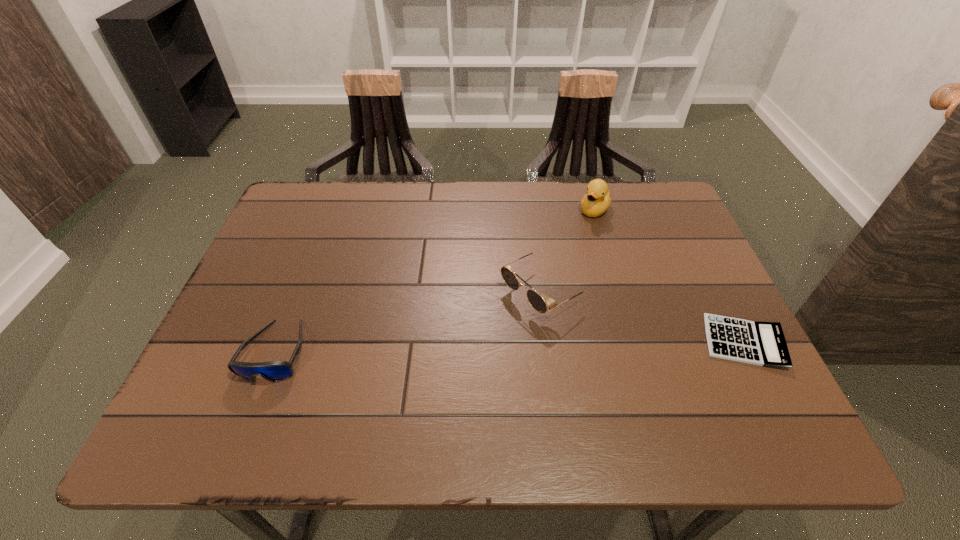
Locate an element on the screen. This screenshot has width=960, height=540. object located at the near left corner is located at coordinates (274, 371).

You are a GUI agent. You are given a task and a screenshot of the screen. Output one action in this format:
    pyautogui.click(x=<x>, y=<y>)
    Task: Click on the object that is at the near right corner
    
    Given the screenshot: What is the action you would take?
    pyautogui.click(x=763, y=344)

Find the location of a particular element. vacant space at the far edge of the desktop is located at coordinates (585, 215).

This screenshot has width=960, height=540. In the image, there is a desktop. Identify the location of free space at the near edge. (666, 395).

Find the location of a particular element. free space at the left edge is located at coordinates (286, 278).

Where is `free space at the right edge of the desktop`? The height and width of the screenshot is (540, 960). free space at the right edge of the desktop is located at coordinates (701, 334).

I want to click on vacant area at the far left corner, so coord(321,188).

This screenshot has width=960, height=540. Find the location of `vacant space at the near left corner of the desktop`. vacant space at the near left corner of the desktop is located at coordinates (235, 391).

Where is `vacant space at the far right corner`? Image resolution: width=960 pixels, height=540 pixels. vacant space at the far right corner is located at coordinates (644, 190).

In the image, there is a desktop. At what (x,y) coordinates should I click in order to perform the action: click on vacant area at the near right corner. Please return your answer as a coordinate pair (x, y). The image size is (960, 540). Looking at the image, I should click on (701, 391).